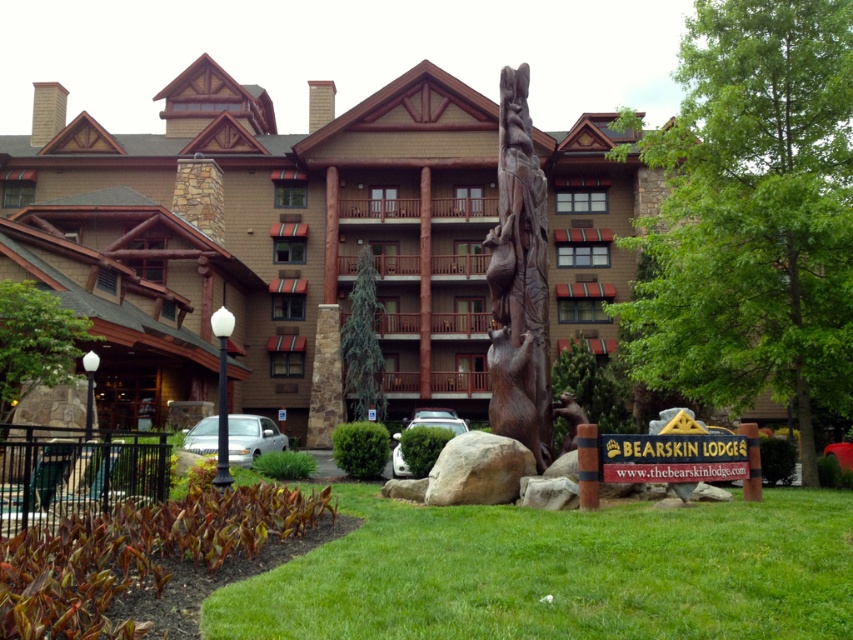
You are standing in front of the Bearskin Lodge and want to take a photo of the two points marked in the scene. Which point, point [780,269] or point [6,337], appears closer to you in the image?

Point [780,269] is closer to the viewer than point [6,337], so it will appear closer in the image.

You are a landscape architect planning to install a new garden feature. You have a small statue that needs to be placed on the green grass at lower center. Considering the space available, will the statue fit comfortably without overcrowding the area compared to the green textured tree at center?

The green grass at lower center occupies less space than the green textured tree at center, so placing the statue there may result in overcrowding since the area is smaller compared to the tree.

You are a landscape architect designing a new pathway near the wooden carving of bear at center and the gray rough rock at center. Which object should you consider in terms of size when planning the pathway width?

The wooden carving of bear at center is larger in size than the gray rough rock at center, so you should consider the size of the wooden carving of bear at center to ensure the pathway width accommodates its scale.